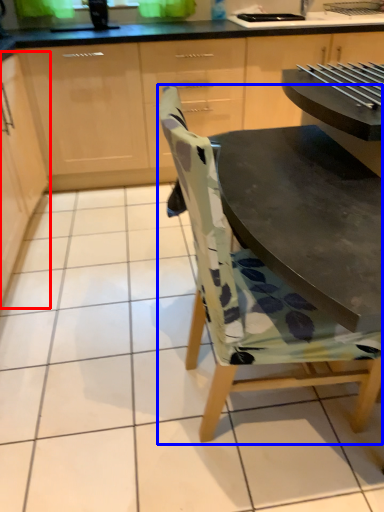
Question: Which of the following is the farthest to the observer, cabinetry (highlighted by a red box) or chair (highlighted by a blue box)?

Choices:
 (A) cabinetry
 (B) chair

Answer: (A)